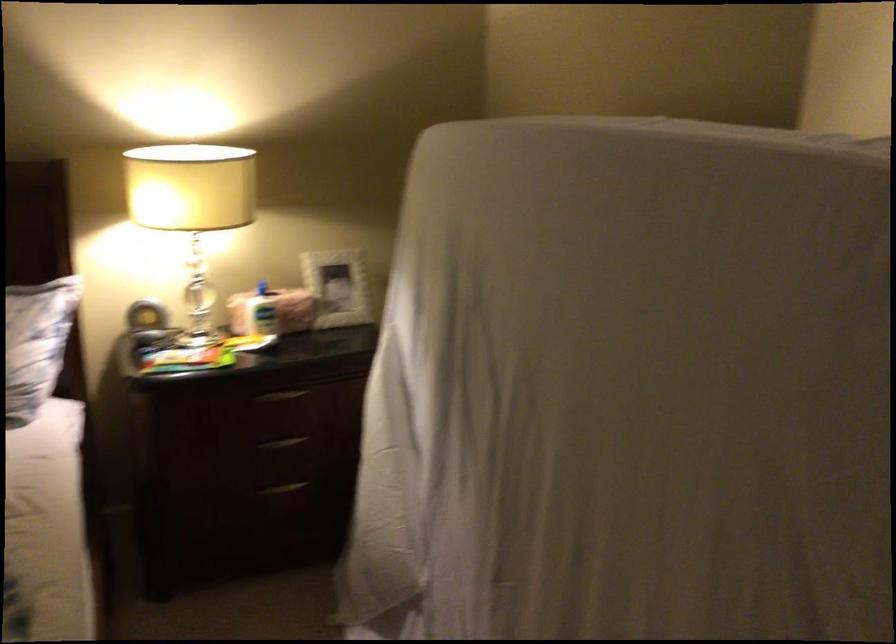
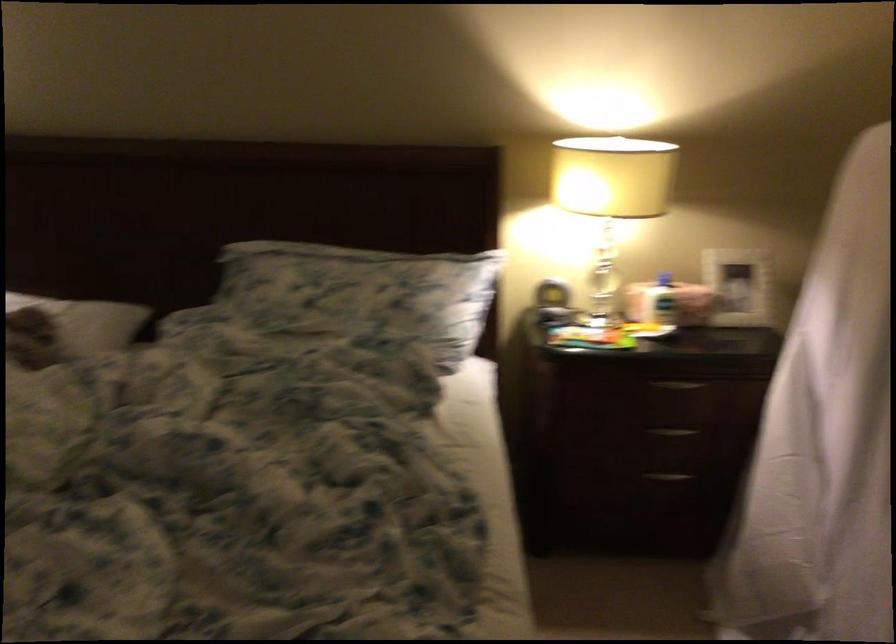
Question: I am providing you with two images of the same scene from different viewpoints. Which of the following objects are not visible in image2?

Choices:
 (A) bottle pump dispenser
 (B) white picture frame
 (C) drawer handle
 (D) none of these

Answer: (D)